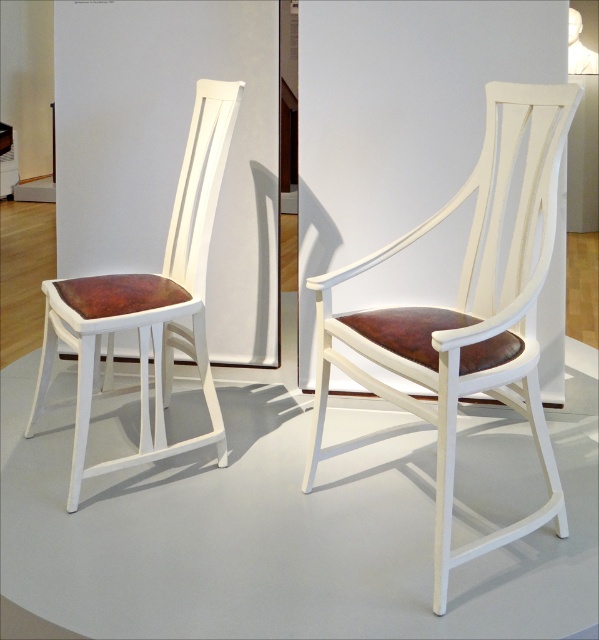
Consider the image. You are standing in the exhibition space and want to touch both the matte white chair at center and the matte white chair at left. Which chair should you approach first to reach the one closer to you?

You should approach the matte white chair at center first because it is closer to you than the matte white chair at left.

You are an interior designer planning to place a new sofa in the exhibition space. The sofa is 1.8 meters wide. You see the matte white chair at center and the matte white chair at left. Which chair has more space between it and the sofa if placed adjacent to each chair?

The matte white chair at left has more space between it and the sofa if placed adjacent because it is wider than the matte white chair at center, which is narrower. Therefore, placing the sofa next to the wider matte white chair at left would require more space.